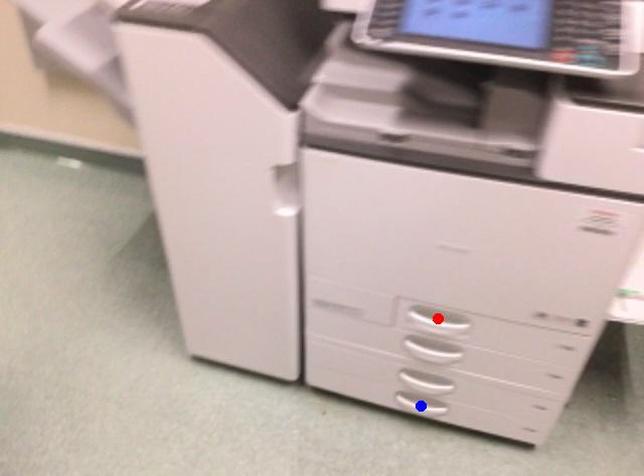
Question: Two points are marked on the image. Which point is closer to the camera?

Choices:
 (A) Blue point is closer.
 (B) Red point is closer.

Answer: (B)